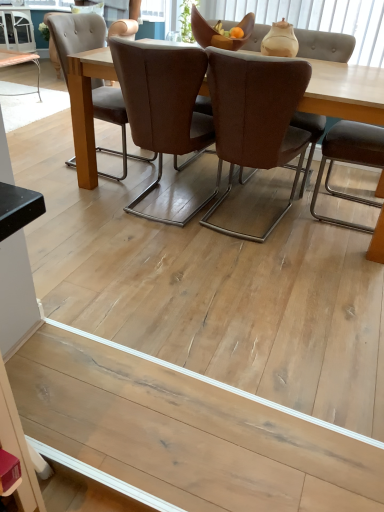
Locate an element on the screen. The image size is (384, 512). vacant space behind brown fabric chair at center, which appears as the second chair when viewed from the left is located at coordinates (243, 181).